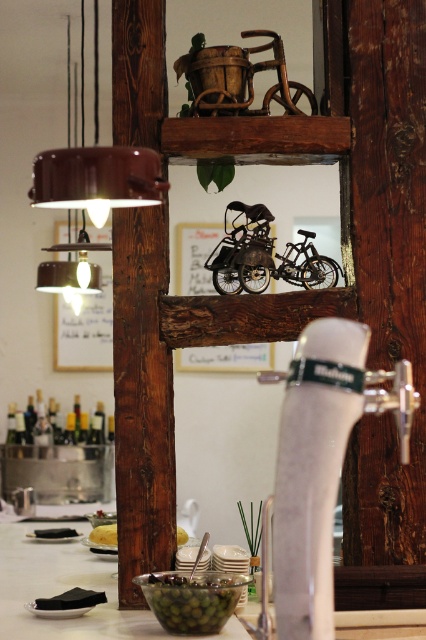
Does brown matte lampshade at upper left appear on the left side of yellow matte cheese at lower center?

Incorrect, brown matte lampshade at upper left is not on the left side of yellow matte cheese at lower center.

Locate an element on the screen. brown matte lampshade at upper left is located at coordinates (97, 179).

Is brown matte lampshade at upper left below green glossy olives at lower center?

No.

Find the location of `brown matte lampshade at upper left`. brown matte lampshade at upper left is located at coordinates (97, 179).

This screenshot has width=426, height=640. Find the location of `brown matte lampshade at upper left`. brown matte lampshade at upper left is located at coordinates (97, 179).

Does brown matte lampshade at upper left come in front of black matte olive at lower left?

That is True.

At what (x,y) coordinates should I click in order to perform the action: click on brown matte lampshade at upper left. Please return your answer as a coordinate pair (x, y). Looking at the image, I should click on (97, 179).

Image resolution: width=426 pixels, height=640 pixels. In order to click on brown matte lampshade at upper left in this screenshot , I will do `click(97, 179)`.